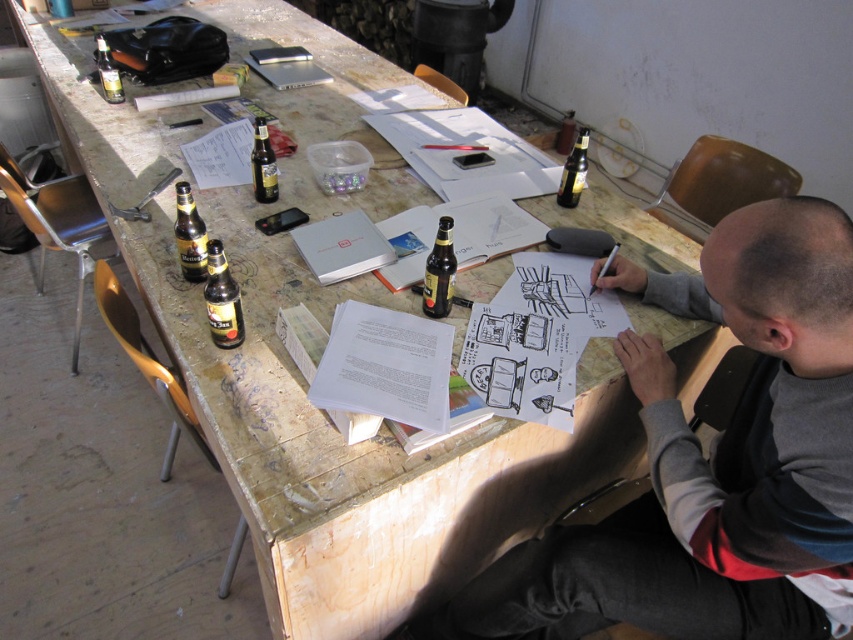
You are a fashion designer who wants to place a new accessory on the gray fabric shirt at upper right. According to the coordinates provided, where exactly should you place the accessory on the shirt?

The gray fabric shirt at upper right is located at coordinates point (714, 461), so the accessory should be placed at that exact point on the shirt.

Consider the image. You are organizing the clutter on the table and need to move the brown glass bottle at left and the matte glass bottle at upper left. Which one should you move first if you want to access the one behind them?

You should move the brown glass bottle at left first because it is in front of the matte glass bottle at upper left, so moving it first will allow access to the one behind.

You are a photographer trying to capture the scene from the current viewpoint. The gray fabric shirt at upper right and the matte glass bottle at upper left are both in your frame. Which object will appear larger in your photo?

The gray fabric shirt at upper right appears larger in the photo because it is closer to the viewer than the matte glass bottle at upper left.